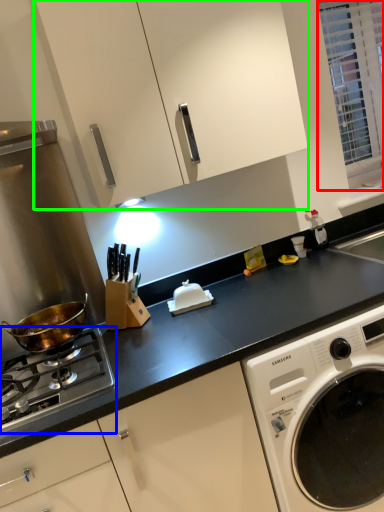
Question: Which object is the closest to the window (highlighted by a red box)? Choose among these: gas stove (highlighted by a blue box) or cabinetry (highlighted by a green box).

Choices:
 (A) gas stove
 (B) cabinetry

Answer: (B)